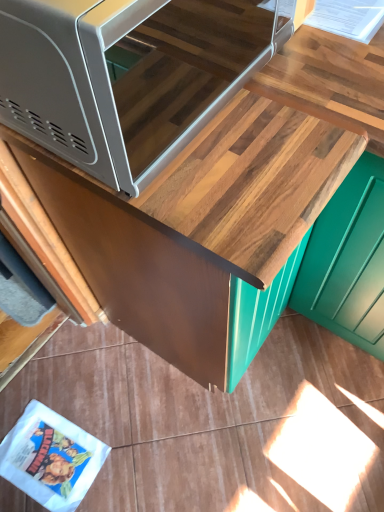
Question: Is matte gray microwave at upper left far away from wooden cabinet at upper center?

Choices:
 (A) yes
 (B) no

Answer: (B)

Question: Is the position of matte gray microwave at upper left more distant than that of wooden cabinet at upper center?

Choices:
 (A) no
 (B) yes

Answer: (A)

Question: Considering the relative positions of matte gray microwave at upper left and wooden cabinet at upper center in the image provided, is matte gray microwave at upper left to the right of wooden cabinet at upper center from the viewer's perspective?

Choices:
 (A) yes
 (B) no

Answer: (B)

Question: Is matte gray microwave at upper left in contact with wooden cabinet at upper center?

Choices:
 (A) yes
 (B) no

Answer: (B)

Question: Is matte gray microwave at upper left smaller than wooden cabinet at upper center?

Choices:
 (A) yes
 (B) no

Answer: (A)

Question: Can you confirm if matte gray microwave at upper left is bigger than wooden cabinet at upper center?

Choices:
 (A) no
 (B) yes

Answer: (A)

Question: Would you say wooden cabinet at upper center is a long distance from matte gray microwave at upper left?

Choices:
 (A) no
 (B) yes

Answer: (A)

Question: Does wooden cabinet at upper center have a smaller size compared to matte gray microwave at upper left?

Choices:
 (A) yes
 (B) no

Answer: (B)

Question: Is the position of wooden cabinet at upper center less distant than that of matte gray microwave at upper left?

Choices:
 (A) no
 (B) yes

Answer: (A)

Question: From a real-world perspective, is wooden cabinet at upper center physically below matte gray microwave at upper left?

Choices:
 (A) yes
 (B) no

Answer: (A)

Question: Considering the relative sizes of wooden cabinet at upper center and matte gray microwave at upper left in the image provided, is wooden cabinet at upper center wider than matte gray microwave at upper left?

Choices:
 (A) no
 (B) yes

Answer: (B)

Question: Can you confirm if wooden cabinet at upper center is taller than matte gray microwave at upper left?

Choices:
 (A) yes
 (B) no

Answer: (A)

Question: Looking at their shapes, would you say wooden cabinet at upper center is wider or thinner than matte gray microwave at upper left?

Choices:
 (A) thin
 (B) wide

Answer: (B)